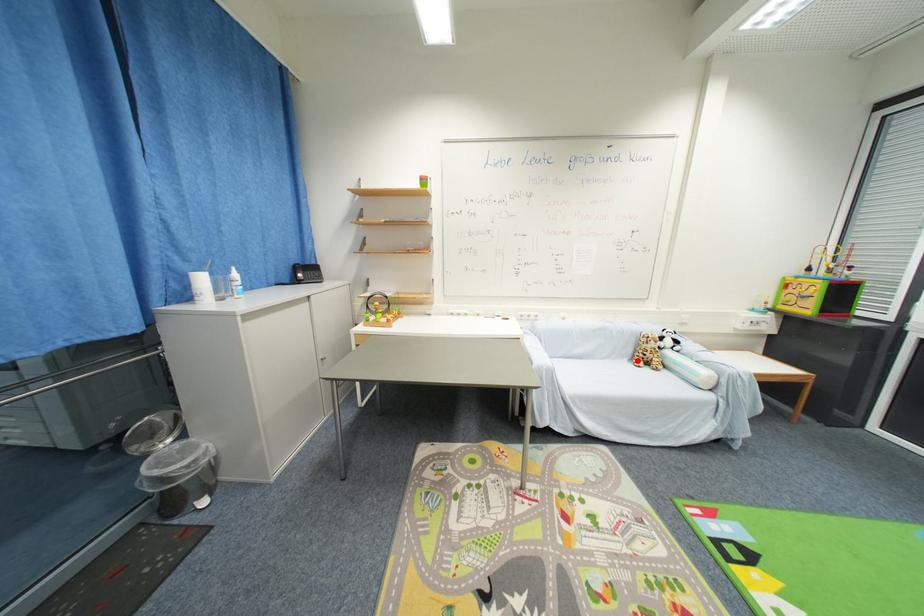
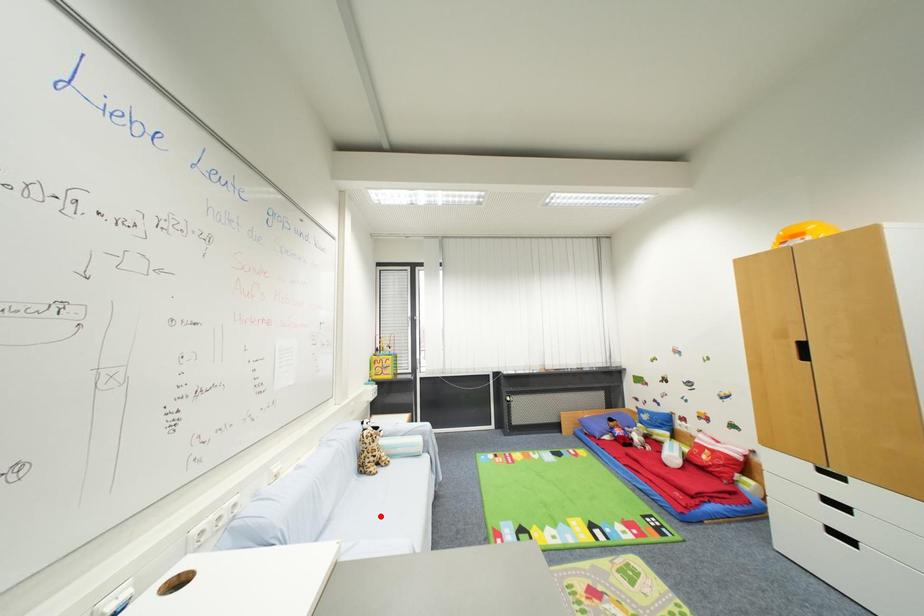
I am providing you with two images of the same scene from different viewpoints. A red point is marked on the first image and another point is marked on the second image. Do the highlighted points in image1 and image2 indicate the same real-world spot?

No